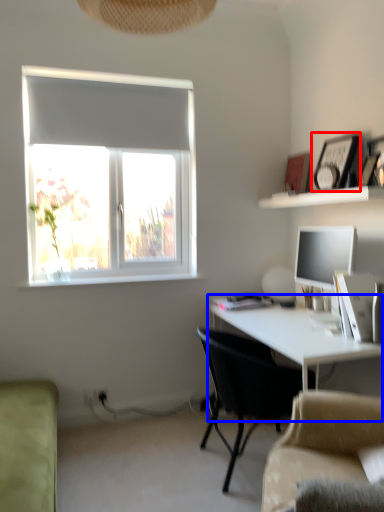
Question: Which object is further to the camera taking this photo, picture frame (highlighted by a red box) or desk (highlighted by a blue box)?

Choices:
 (A) picture frame
 (B) desk

Answer: (A)